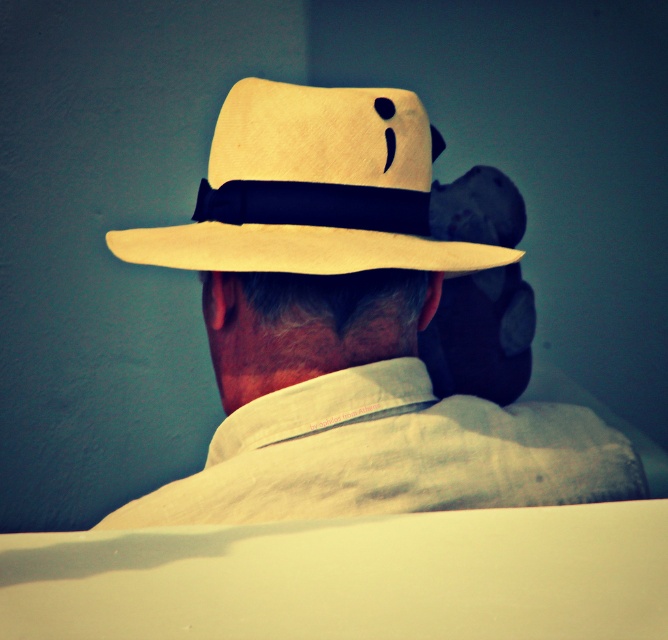
You are organizing a hat display and need to arrange the matte straw hat at center and the suede beige fedora at center in a specific order. According to the image, which hat should be placed on the left side of the display?

The suede beige fedora at center should be placed on the left side of the display because the matte straw hat at center is to the right of it in the image.

You are an interior designer arranging two hats on a display stand. The matte straw hat at center and the suede beige fedora at center need to be placed in a specific order. According to the scene, which hat should be positioned lower on the stand?

The matte straw hat at center should be positioned lower on the stand because it is described as being below the suede beige fedora at center in the scene.

You are a hat designer observing the image. You need to determine which hat, the matte straw hat at center or the suede beige fedora at center, has a larger circumference to recommend for a client who prefers wider brim coverage. Which one should you suggest?

The matte straw hat at center has a larger circumference than the suede beige fedora at center, so it should be recommended for the client seeking wider brim coverage.